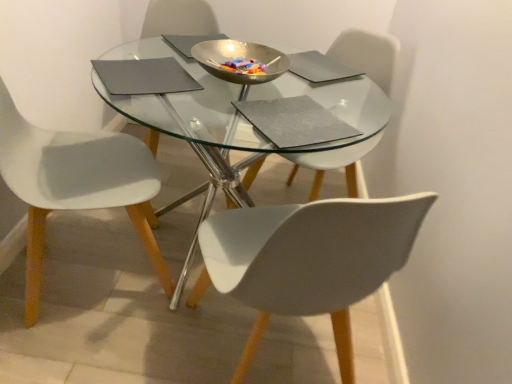
You are a GUI agent. You are given a task and a screenshot of the screen. Output one action in this format:
    pyautogui.click(x=<x>, y=<y>)
    Task: Click on the vacant space in white matte chair at lower left, the 3th chair positioned from the right (from a real-world perspective)
    
    Given the screenshot: What is the action you would take?
    pyautogui.click(x=73, y=265)